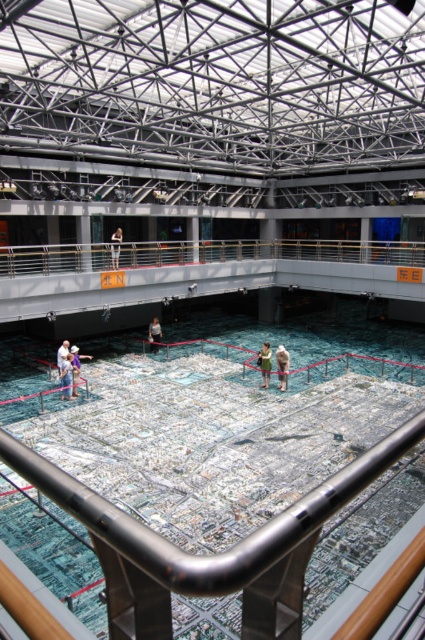
You are a visitor at the exhibition and want to take a photo of the city model without any people blocking the view. You see the denim pants at lower left and the white cotton dress at center. Which person should you move out of the way first to get a clear shot?

The denim pants at lower left is below the white cotton dress at center, so you should move the white cotton dress at center first as it is closer to the camera and blocking the view.

You are a visitor at the exhibition hall and want to place your light brown fabric bag at center on the floor near the city model without blocking the view of the white cotton shirt at lower left. Since the bag is 9.41 meters away from the shirt, is the distance sufficient to avoid blocking their view?

The light brown fabric bag at center is 9.41 meters away from the white cotton shirt at lower left. This distance is likely sufficient to avoid blocking their view as the bag is placed far enough from the shirt.